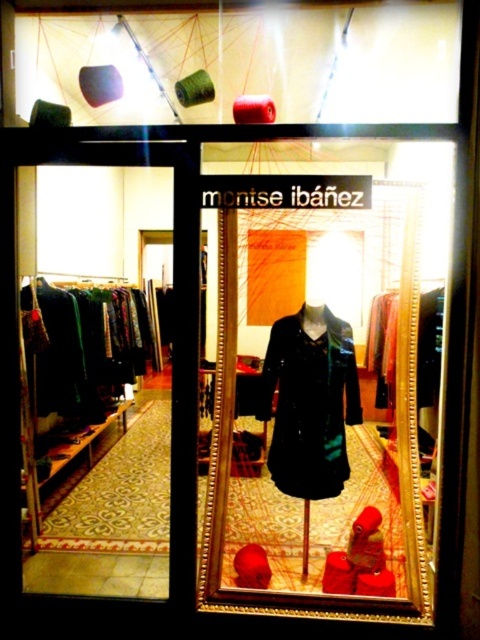
Who is more distant from viewer, (x=312, y=493) or (x=107, y=397)?

Point (x=107, y=397)

Does velvet-like dark green coat at center have a greater height compared to green fabric dress at left?

No, velvet-like dark green coat at center is not taller than green fabric dress at left.

You are a GUI agent. You are given a task and a screenshot of the screen. Output one action in this format:
    pyautogui.click(x=<x>, y=<y>)
    Task: Click on the velvet-like dark green coat at center
    The image size is (480, 640).
    Given the screenshot: What is the action you would take?
    pyautogui.click(x=310, y=401)